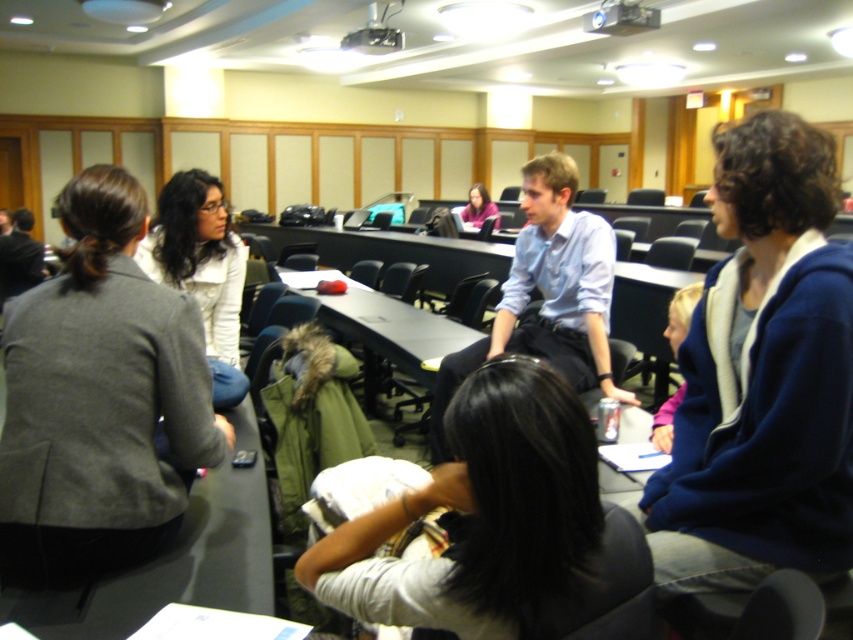
Question: Which of the following is the farthest from the observer?

Choices:
 (A) gray woolen blazer at left
 (B) matte black table at center

Answer: (B)

Question: Estimate the real-world distances between objects in this image. Which object is farther from the gray wool jacket at left?

Choices:
 (A) light blue shirt at center
 (B) light gray cotton shirt at center

Answer: (B)

Question: Can you confirm if blue fleece jacket at right is positioned to the left of gray wool jacket at left?

Choices:
 (A) no
 (B) yes

Answer: (A)

Question: Which of the following is the farthest from the observer?

Choices:
 (A) gray woolen blazer at left
 (B) matte black table at center
 (C) white matte jacket at upper left
 (D) light blue shirt at center

Answer: (B)

Question: Can you confirm if blue fleece jacket at right is positioned to the left of gray woolen blazer at left?

Choices:
 (A) no
 (B) yes

Answer: (A)

Question: Is light gray cotton shirt at center bigger than pink fleece sweater at center?

Choices:
 (A) yes
 (B) no

Answer: (B)